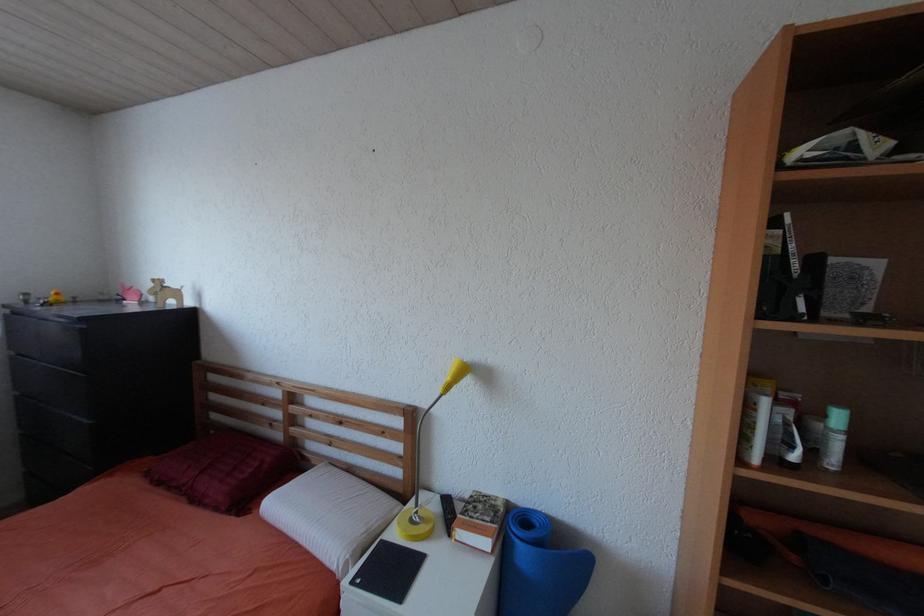
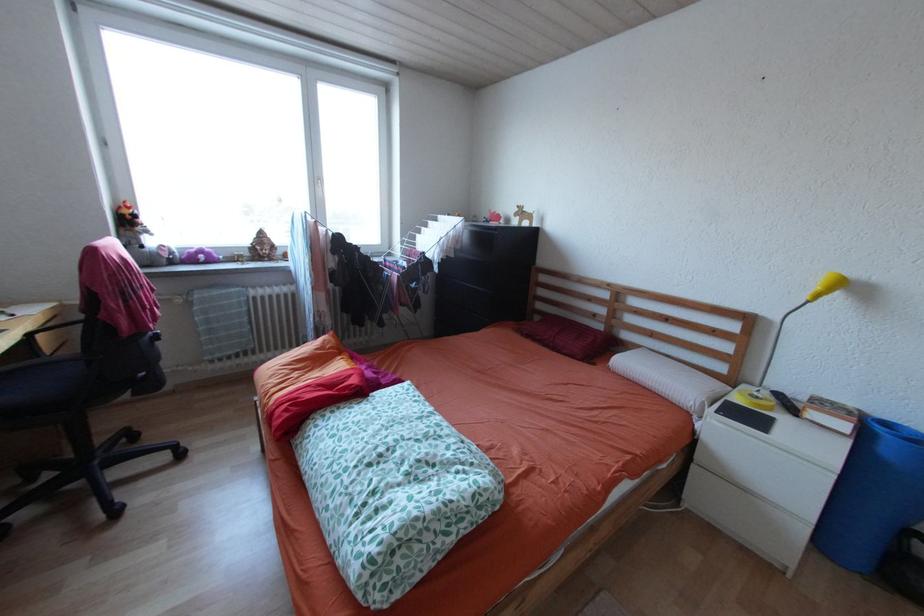
Question: Based on the continuous images, in which direction is the camera rotating? Reply with the corresponding letter.

Choices:
 (A) Left
 (B) Right
 (C) Up
 (D) Down

Answer: (A)